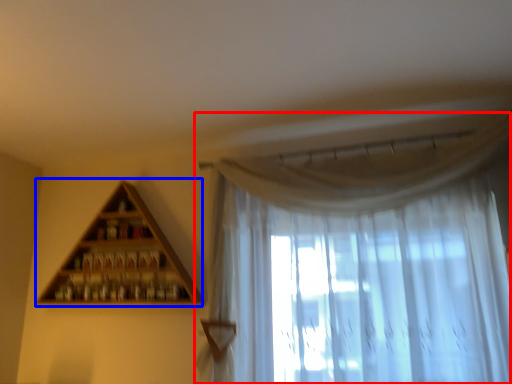
Question: Which of the following is the closest to the observer, curtain (highlighted by a red box) or shelf (highlighted by a blue box)?

Choices:
 (A) curtain
 (B) shelf

Answer: (A)